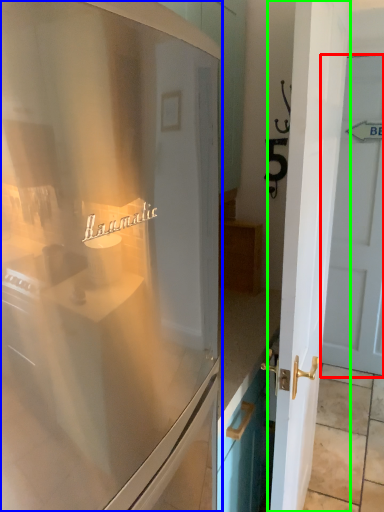
Question: Which object is positioned closest to door (highlighted by a red box)? Select from refrigerator (highlighted by a blue box) and door (highlighted by a green box).

Choices:
 (A) refrigerator
 (B) door

Answer: (B)